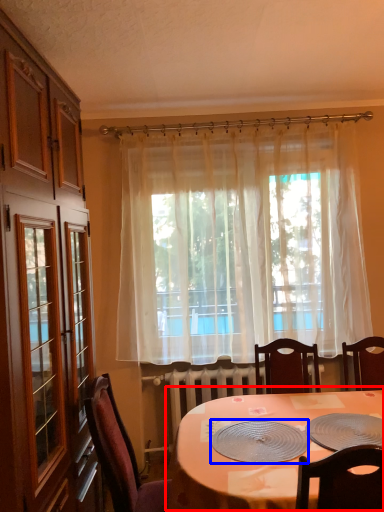
Question: Which object is further to the camera taking this photo, table (highlighted by a red box) or platter (highlighted by a blue box)?

Choices:
 (A) table
 (B) platter

Answer: (B)